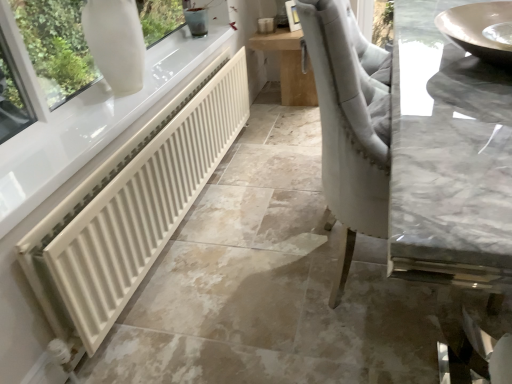
Question: Is white matte radiator at lower left bigger or smaller than matte gray sink at upper right?

Choices:
 (A) big
 (B) small

Answer: (A)

Question: Based on their positions, is white matte radiator at lower left located to the left or right of matte gray sink at upper right?

Choices:
 (A) left
 (B) right

Answer: (A)

Question: Considering the real-world distances, which object is farthest from the white glossy vase at upper left?

Choices:
 (A) wooden table at center
 (B) white matte radiator at lower left
 (C) matte gray sink at upper right

Answer: (A)

Question: Which is nearer to the matte gray sink at upper right?

Choices:
 (A) white matte radiator at lower left
 (B) white glossy vase at upper left
 (C) wooden table at center

Answer: (A)